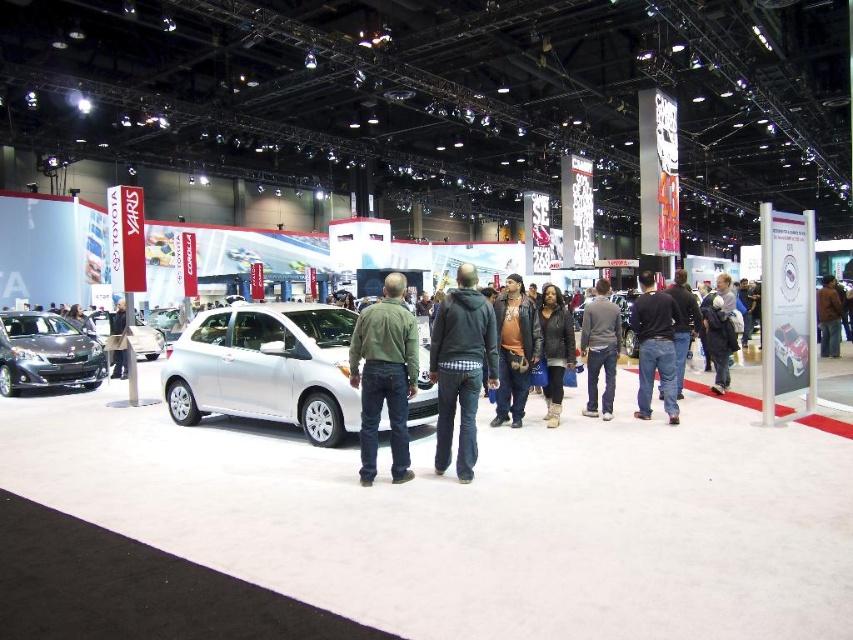
Question: Which object is closer to the camera taking this photo?

Choices:
 (A) matte black jacket at center
 (B) green matte jacket at center

Answer: (B)

Question: Which point is closer to the camera?

Choices:
 (A) (393, 273)
 (B) (474, 362)
 (C) (558, 419)
 (D) (521, 394)

Answer: (B)

Question: Which is nearer to the leather jacket at center?

Choices:
 (A) satin silver car at center
 (B) gray cotton hoodie at center
 (C) matte black car at left

Answer: (B)

Question: Is satin silver car at center to the left of dark gray jeans at center from the viewer's perspective?

Choices:
 (A) no
 (B) yes

Answer: (A)

Question: Is green matte jacket at center positioned behind white glossy car at center?

Choices:
 (A) no
 (B) yes

Answer: (A)

Question: Can you confirm if green matte jacket at center is wider than dark gray hoodie at center?

Choices:
 (A) no
 (B) yes

Answer: (B)